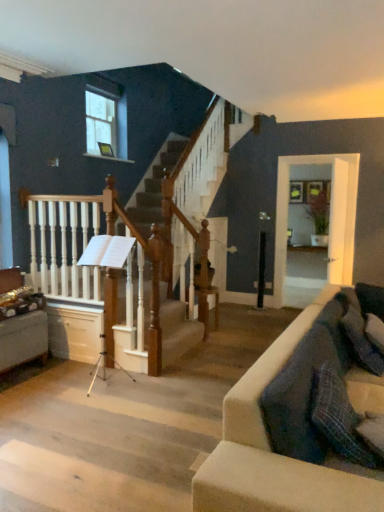
The image size is (384, 512). What do you see at coordinates (105, 118) in the screenshot?
I see `clear glass window at upper left` at bounding box center [105, 118].

Find the location of a particular element. This screenshot has height=512, width=384. clear glass window at upper left is located at coordinates (105, 118).

Describe the element at coordinates (102, 287) in the screenshot. I see `white wood railing at left` at that location.

Identify the location of white wood railing at left. Image resolution: width=384 pixels, height=512 pixels. (102, 287).

Identify the location of clear glass window at upper left. Image resolution: width=384 pixels, height=512 pixels. (105, 118).

From the picture: Between clear glass window at upper left and white wood railing at left, which one appears on the right side from the viewer's perspective?

white wood railing at left is more to the right.

Considering their positions, is clear glass window at upper left located in front of or behind white wood railing at left?

clear glass window at upper left is positioned farther from the viewer than white wood railing at left.

Between point (113, 99) and point (107, 289), which one is positioned behind?

The point (113, 99) is farther.

From the image's perspective, between clear glass window at upper left and white wood railing at left, which one is located above?

From the image's view, clear glass window at upper left is above.

From a real-world perspective, who is located higher, clear glass window at upper left or white wood railing at left?

clear glass window at upper left, from a real-world perspective.

Does clear glass window at upper left have a greater width compared to white wood railing at left?

No.

Is clear glass window at upper left taller than white wood railing at left?

Incorrect, the height of clear glass window at upper left is not larger of that of white wood railing at left.

Between clear glass window at upper left and white wood railing at left, which one has smaller size?

With smaller size is clear glass window at upper left.

Is clear glass window at upper left completely or partially outside of white wood railing at left?

Yes.

Is clear glass window at upper left not near white wood railing at left?

Yes, clear glass window at upper left and white wood railing at left are quite far apart.

Is clear glass window at upper left positioned with its back to white wood railing at left?

No, clear glass window at upper left is not facing the opposite direction of white wood railing at left.

What's the angular difference between clear glass window at upper left and white wood railing at left's facing directions?

90.6 degrees.

The height and width of the screenshot is (512, 384). I want to click on rail in front of the clear glass window at upper left, so coord(102,287).

Can you confirm if white wood railing at left is positioned to the right of clear glass window at upper left?

Correct, you'll find white wood railing at left to the right of clear glass window at upper left.

Does white wood railing at left lie behind clear glass window at upper left?

No, the depth of white wood railing at left is less than that of clear glass window at upper left.

Which is farther, (x=162, y=312) or (x=119, y=98)?

The point (x=119, y=98) is behind.

Looking at this image, from the image's perspective, is white wood railing at left on clear glass window at upper left?

No, from the image's perspective, white wood railing at left is not on top of clear glass window at upper left.

From a real-world perspective, is white wood railing at left above or below clear glass window at upper left?

white wood railing at left is situated lower than clear glass window at upper left in the real world.

Which object is wider, white wood railing at left or clear glass window at upper left?

Wider between the two is white wood railing at left.

Which of these two, white wood railing at left or clear glass window at upper left, stands shorter?

clear glass window at upper left.

Considering the relative sizes of white wood railing at left and clear glass window at upper left in the image provided, is white wood railing at left bigger than clear glass window at upper left?

Yes, white wood railing at left is bigger than clear glass window at upper left.

Based on the photo, is clear glass window at upper left surrounded by white wood railing at left?

No, white wood railing at left does not contain clear glass window at upper left.

Are white wood railing at left and clear glass window at upper left located far from each other?

Yes.

Is white wood railing at left positioned with its back to clear glass window at upper left?

white wood railing at left does not have its back to clear glass window at upper left.

How many degrees apart are the facing directions of white wood railing at left and clear glass window at upper left?

The angle between the facing direction of white wood railing at left and the facing direction of clear glass window at upper left is 90.6 degrees.

How far apart are white wood railing at left and clear glass window at upper left?

white wood railing at left and clear glass window at upper left are 6.08 feet apart from each other.

This screenshot has width=384, height=512. I want to click on window that is above the white wood railing at left (from a real-world perspective), so pyautogui.click(x=105, y=118).

Find the location of a particular element. The width and height of the screenshot is (384, 512). window lying behind the white wood railing at left is located at coordinates (105, 118).

At what (x,y) coordinates should I click in order to perform the action: click on rail below the clear glass window at upper left (from a real-world perspective). Please return your answer as a coordinate pair (x, y). Looking at the image, I should click on (102, 287).